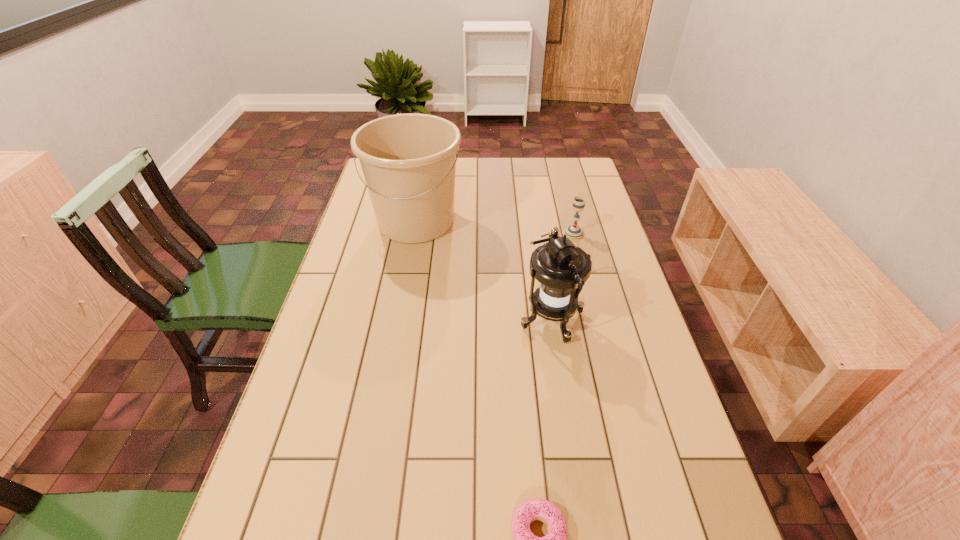
Identify the location of free space at the left edge of the desktop. This screenshot has width=960, height=540. (291, 473).

In the image, there is a desktop. Identify the location of vacant space at the right edge. The image size is (960, 540). (662, 533).

In the image, there is a desktop. Where is `free space at the far right corner`? This screenshot has width=960, height=540. free space at the far right corner is located at coordinates (587, 182).

Image resolution: width=960 pixels, height=540 pixels. I want to click on vacant area that lies between the second shortest object and the leftmost object, so click(x=494, y=227).

Identify the location of free area in between the bucket and the chalice. (494, 227).

Locate an element on the screen. Image resolution: width=960 pixels, height=540 pixels. empty space that is in between the leftmost object and the second nearest object is located at coordinates (484, 271).

Where is `free space between the lantern and the leftmost object`? This screenshot has height=540, width=960. free space between the lantern and the leftmost object is located at coordinates (484, 271).

Locate an element on the screen. The width and height of the screenshot is (960, 540). blank region between the chalice and the bucket is located at coordinates (494, 227).

Locate an element on the screen. The width and height of the screenshot is (960, 540). object that is the nearest to the doughnut is located at coordinates (562, 268).

Identify which object is the second closest to the shortest object. Please provide its 2D coordinates. Your answer should be formatted as a tuple, i.e. [(x, y)], where the tuple contains the x and y coordinates of a point satisfying the conditions above.

[(408, 160)]